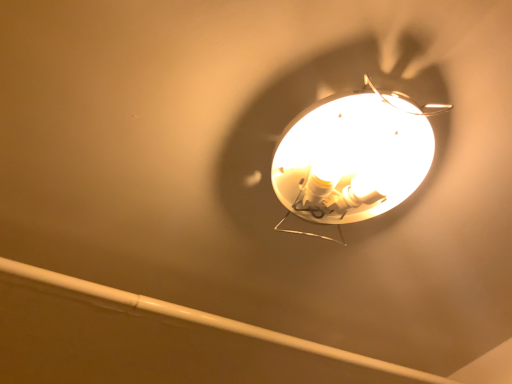
Where is `white glossy lampshade at upper center`? white glossy lampshade at upper center is located at coordinates (353, 157).

What do you see at coordinates (353, 157) in the screenshot?
I see `white glossy lampshade at upper center` at bounding box center [353, 157].

At what (x,y) coordinates should I click in order to perform the action: click on white glossy lampshade at upper center. Please return your answer as a coordinate pair (x, y). Looking at the image, I should click on (353, 157).